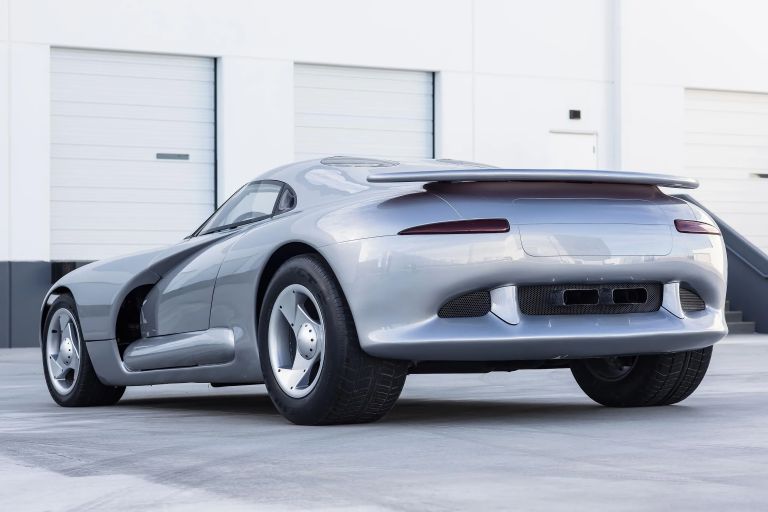
What are the coordinates of `staircase` in the screenshot? It's located at tap(743, 316).